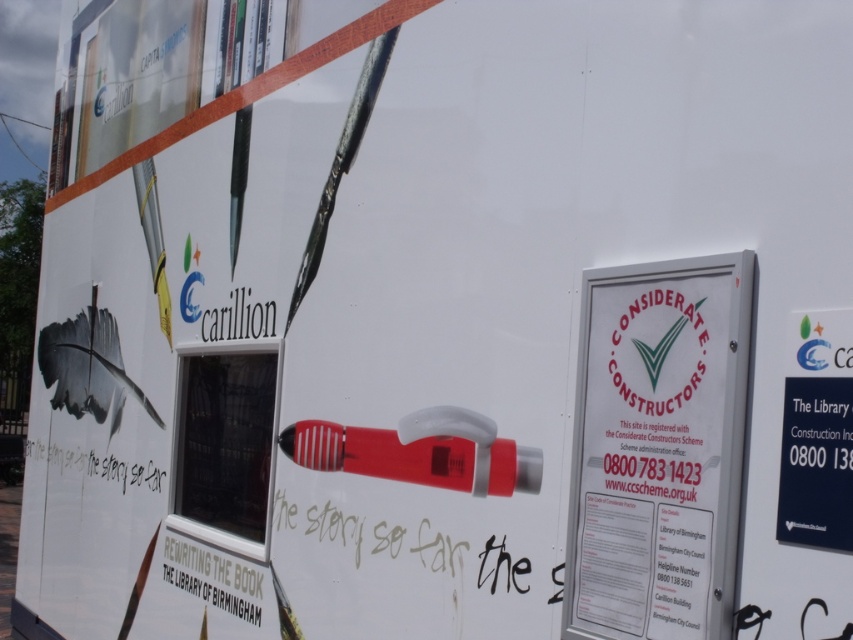
You are standing in front of the construction hoarding for The Library of Birmingham. You notice two points marked on the hoarding at coordinates point [618,268] and point [368,436]. Based on their positions, which point is closer to you?

Point [618,268] is in front of point [368,436], so it is closer to you.

You are standing in front of the construction hoarding for The Library of Birmingham. You see a white plastic sign at center and a red plastic pen at center. Which object is closer to you?

The white plastic sign at center is closer to the viewer than the red plastic pen at center.